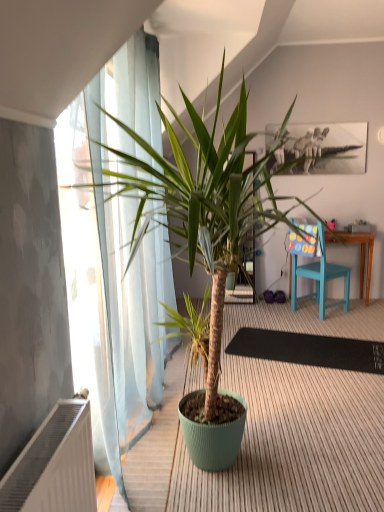
Question: Is green matte plant pot at center bigger or smaller than white plastic radiator at lower left?

Choices:
 (A) small
 (B) big

Answer: (B)

Question: Is green matte plant pot at center inside or outside of white plastic radiator at lower left?

Choices:
 (A) outside
 (B) inside

Answer: (A)

Question: Which object is the farthest from the teal wood chair at right?

Choices:
 (A) green matte plant pot at center
 (B) black rubber mat at center
 (C) white plastic radiator at lower left

Answer: (C)

Question: Estimate the real-world distances between objects in this image. Which object is closer to the green matte plant pot at center?

Choices:
 (A) black rubber mat at center
 (B) teal wood chair at right
 (C) white plastic radiator at lower left

Answer: (C)